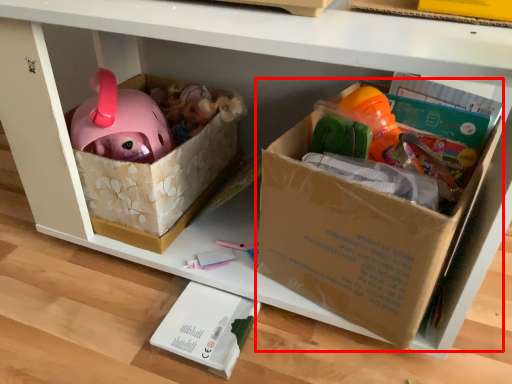
Question: Considering the relative positions of cardboard box (annotated by the red box) and box in the image provided, where is cardboard box (annotated by the red box) located with respect to the staircase?

Choices:
 (A) left
 (B) right

Answer: (B)